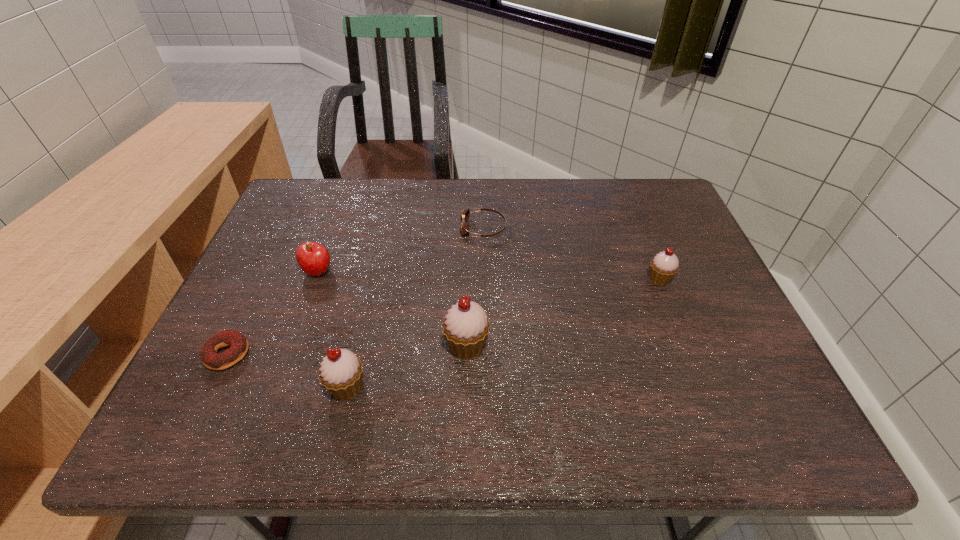
Please point a space for a new cupcake to maintain equal intervals. Please provide its 2D coordinates. Your answer should be formatted as a tuple, i.e. [(x, y)], where the tuple contains the x and y coordinates of a point satisfying the conditions above.

[(569, 310)]